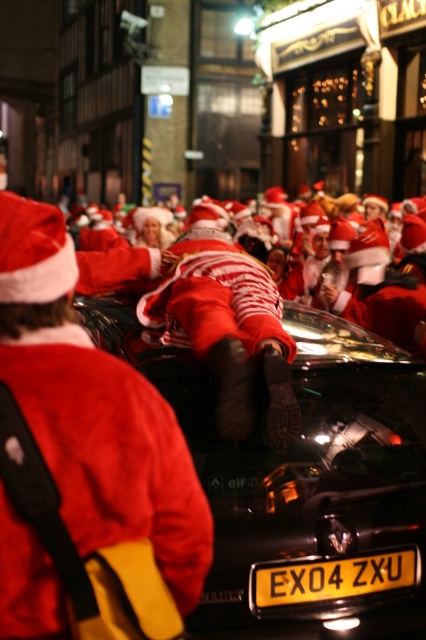
Question: Does fuzzy red santa at center appear under yellow metallic license plate at center?

Choices:
 (A) no
 (B) yes

Answer: (A)

Question: Which object is farther from the camera taking this photo?

Choices:
 (A) yellow metallic license plate at center
 (B) shiny red santa at center

Answer: (A)

Question: Does shiny red santa at center have a lesser width compared to yellow metallic license plate at center?

Choices:
 (A) no
 (B) yes

Answer: (A)

Question: Estimate the real-world distances between objects in this image. Which object is farther from the fuzzy red santa at center?

Choices:
 (A) shiny red santa at center
 (B) shiny black car at center
 (C) yellow metallic license plate at center

Answer: (B)

Question: Which object appears farthest from the camera in this image?

Choices:
 (A) fuzzy red santa at center
 (B) shiny red santa at center
 (C) shiny black car at center

Answer: (C)

Question: Observing the image, what is the correct spatial positioning of shiny red santa at center in reference to yellow metallic license plate at center?

Choices:
 (A) right
 (B) left

Answer: (B)